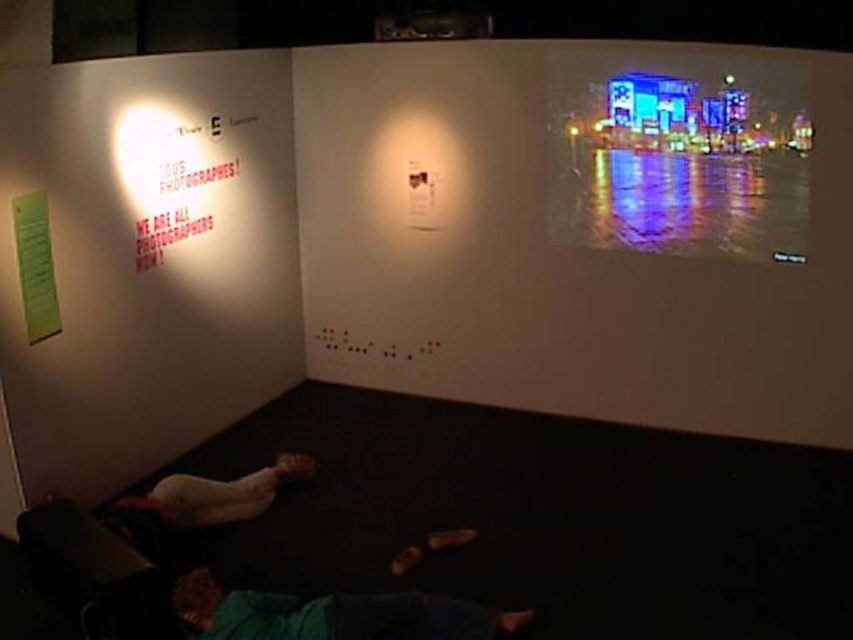
Question: Can you confirm if reflective glass cityscape at upper right is positioned above smooth skin person at lower center?

Choices:
 (A) yes
 (B) no

Answer: (A)

Question: Does green fabric pants at lower center lie behind green paper at left?

Choices:
 (A) no
 (B) yes

Answer: (A)

Question: Does green fabric pants at lower center appear on the right side of smooth skin person at lower center?

Choices:
 (A) yes
 (B) no

Answer: (A)

Question: Which object is farther from the camera taking this photo?

Choices:
 (A) green paper at left
 (B) reflective glass cityscape at upper right
 (C) green fabric pants at lower center

Answer: (B)

Question: Which point appears closest to the camera in this image?

Choices:
 (A) (13, 234)
 (B) (186, 481)
 (C) (727, 204)

Answer: (A)

Question: Which object appears closest to the camera in this image?

Choices:
 (A) smooth skin person at lower center
 (B) green fabric pants at lower center
 (C) reflective glass cityscape at upper right
 (D) green paper at left

Answer: (B)